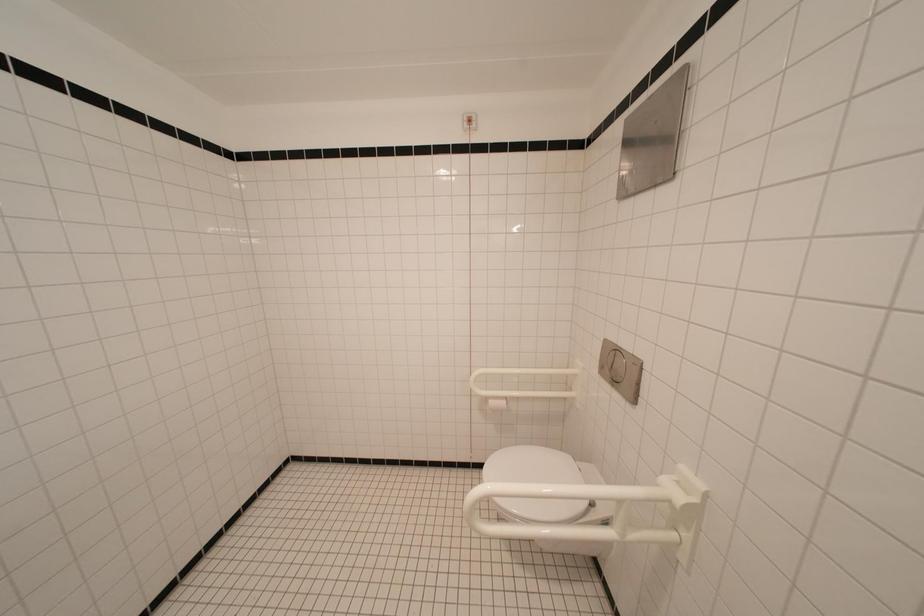
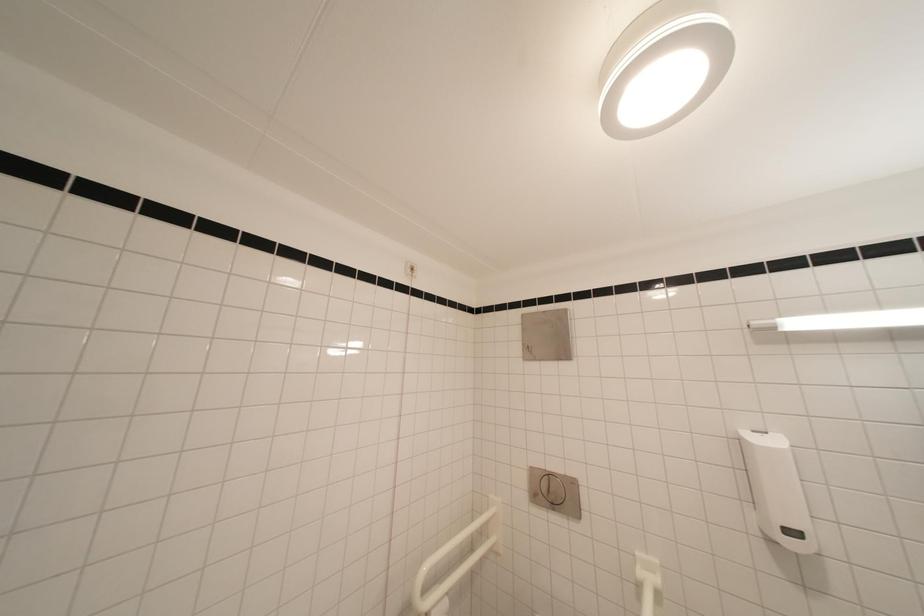
The images are taken continuously from a first-person perspective. In which direction is your viewpoint rotating?

The rotation direction of the camera is right-up.